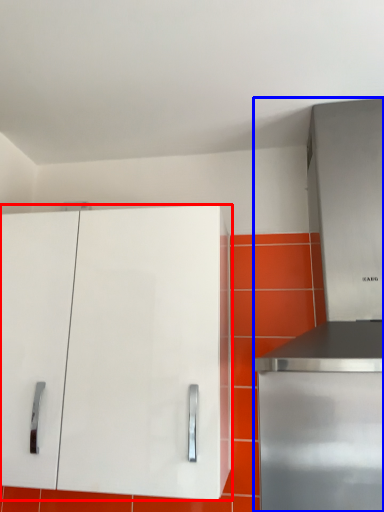
Question: Which point is closer to the camera, cabinetry (highlighted by a red box) or appliance (highlighted by a blue box)?

Choices:
 (A) cabinetry
 (B) appliance

Answer: (B)